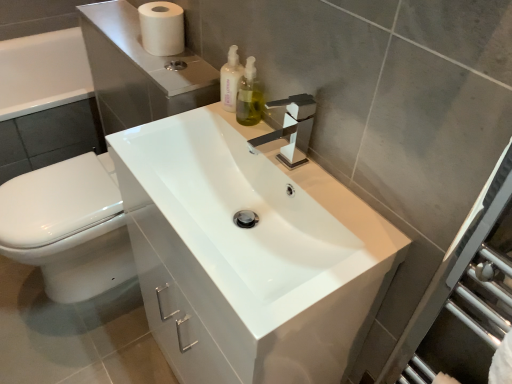
Find the location of a particular element. The image size is (512, 384). free space to the left of white matte toilet paper at upper left is located at coordinates (119, 36).